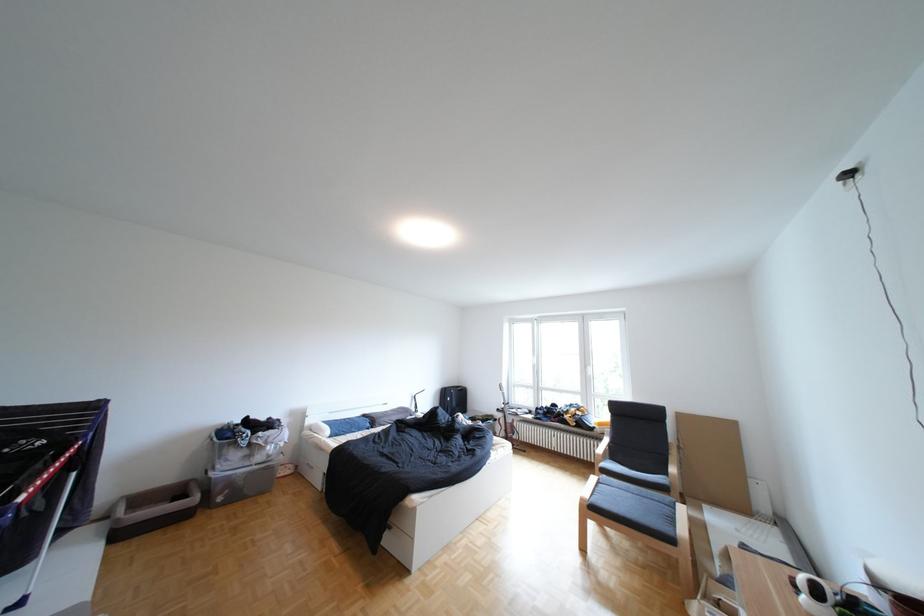
The width and height of the screenshot is (924, 616). What are the coordinates of `white headphones` in the screenshot? It's located at click(829, 599).